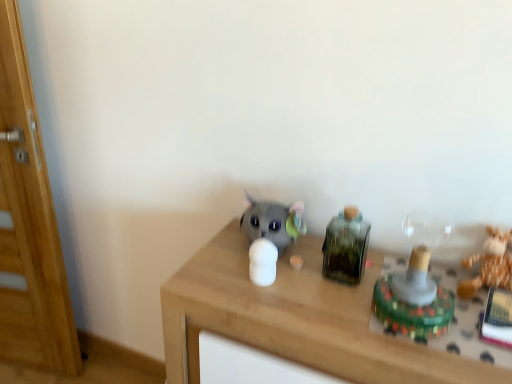
This screenshot has width=512, height=384. I want to click on vacant position to the left of matte gray plush toy at center, positioned as the 1th toy in left-to-right order, so click(215, 262).